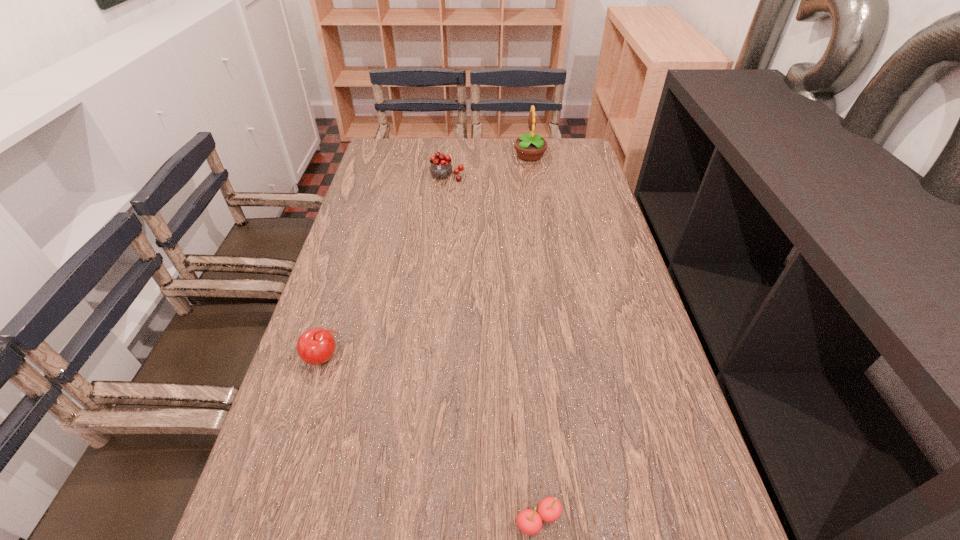
The image size is (960, 540). I want to click on free region that satisfies the following two spatial constraints: 1. on the face of the farthest object; 2. on the handle side of the third nearest object, so click(533, 177).

This screenshot has width=960, height=540. What are the coordinates of `vacant space that satisfies the following two spatial constraints: 1. on the front side of the second tallest cherry; 2. on the left side of the nearest object` in the screenshot? It's located at (276, 519).